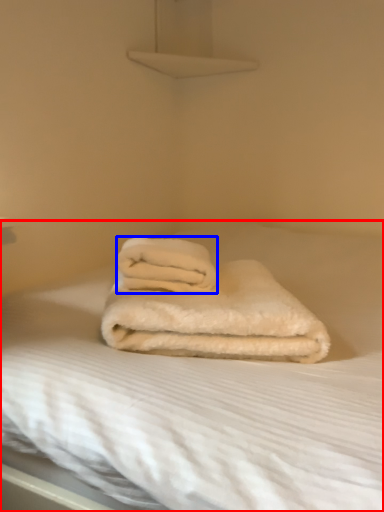
Question: Which object appears closest to the camera in this image, bed (highlighted by a red box) or towel (highlighted by a blue box)?

Choices:
 (A) bed
 (B) towel

Answer: (A)